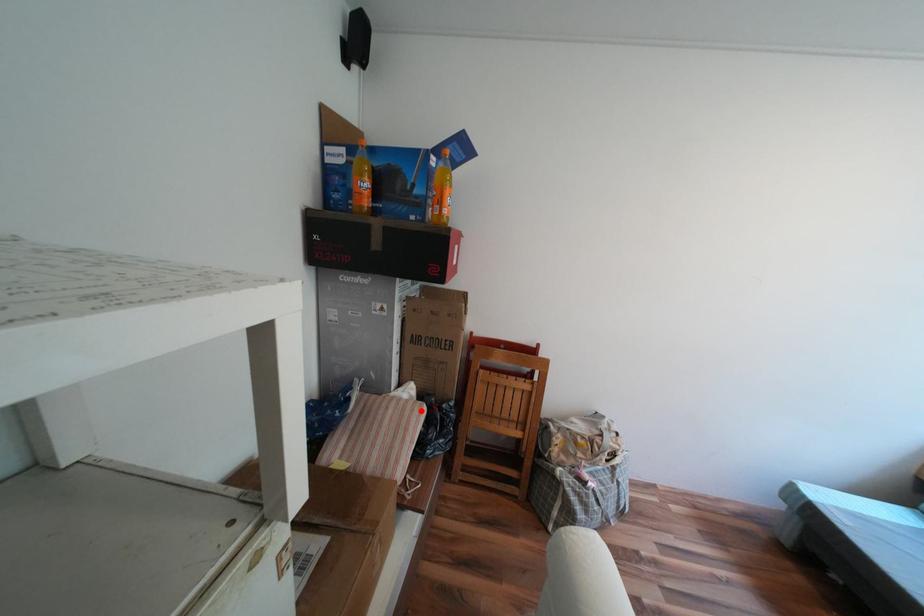
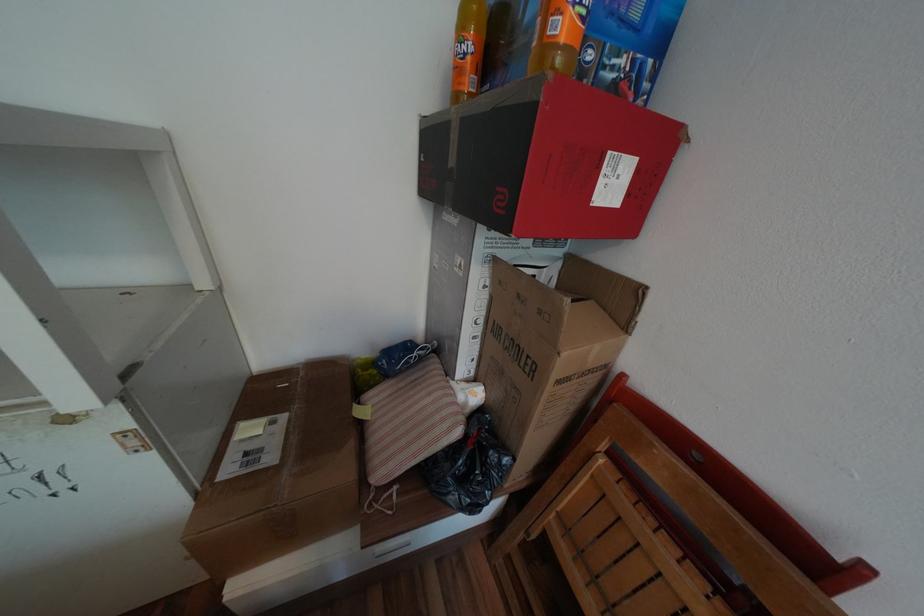
In the second image, find the point that corresponds to the highlighted location in the first image.

(453, 419)